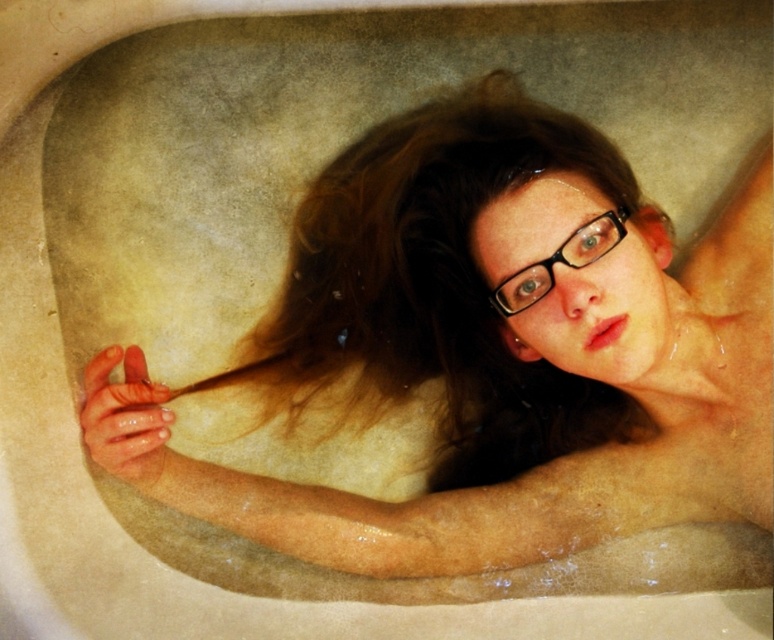
Question: Does smooth skin girl at center appear over black plastic glasses at center?

Choices:
 (A) yes
 (B) no

Answer: (B)

Question: Is smooth skin girl at center to the right of black plastic glasses at center from the viewer's perspective?

Choices:
 (A) no
 (B) yes

Answer: (A)

Question: Which point appears closest to the camera in this image?

Choices:
 (A) (605, 227)
 (B) (415, 381)

Answer: (A)

Question: Among these objects, which one is nearest to the camera?

Choices:
 (A) black plastic glasses at center
 (B) smooth skin girl at center

Answer: (B)

Question: Can you confirm if smooth skin girl at center is positioned to the right of black plastic glasses at center?

Choices:
 (A) no
 (B) yes

Answer: (A)